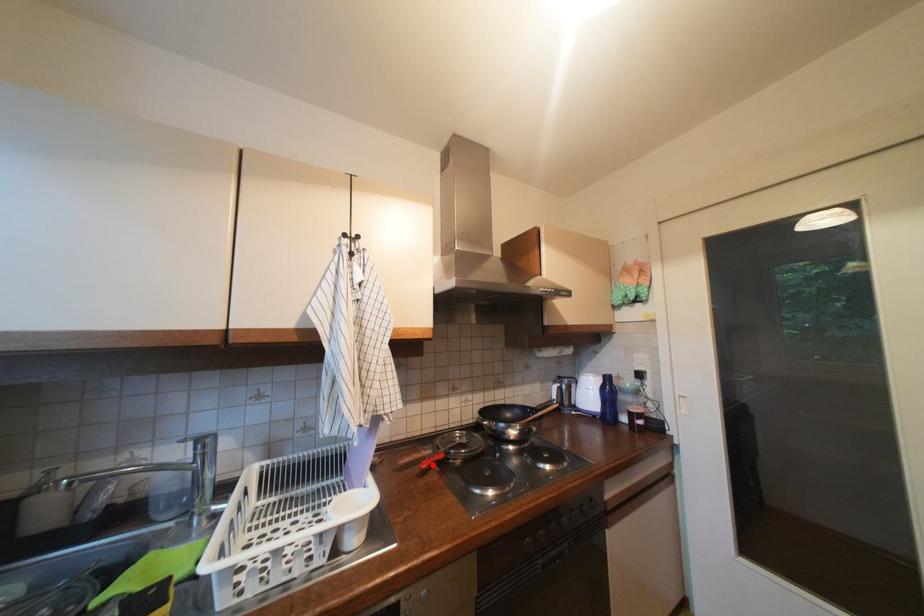
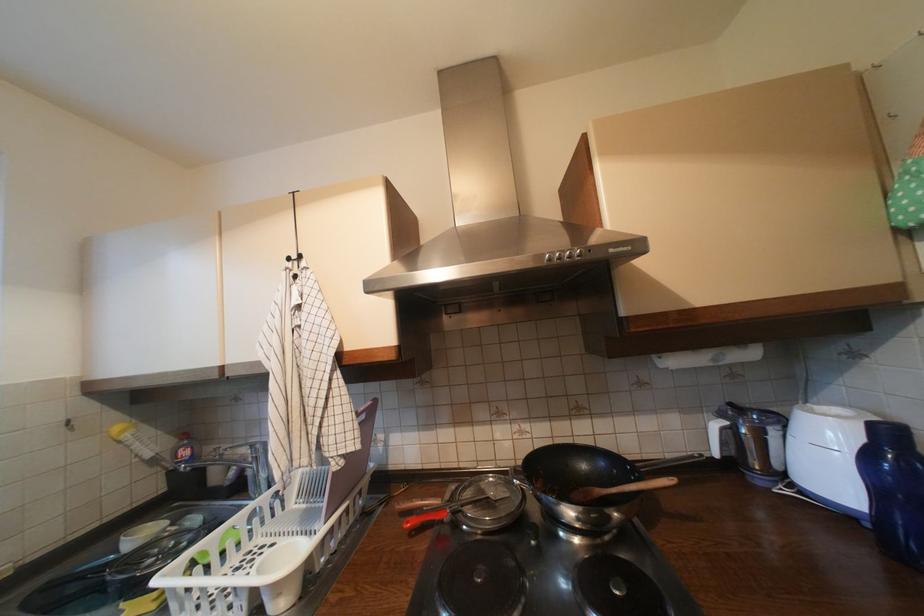
Question: I am providing you with two images of the same scene from different viewpoints. A red point is marked on the first image. Can you still see the location of the red point in image 2?

Choices:
 (A) Yes
 (B) No

Answer: (A)